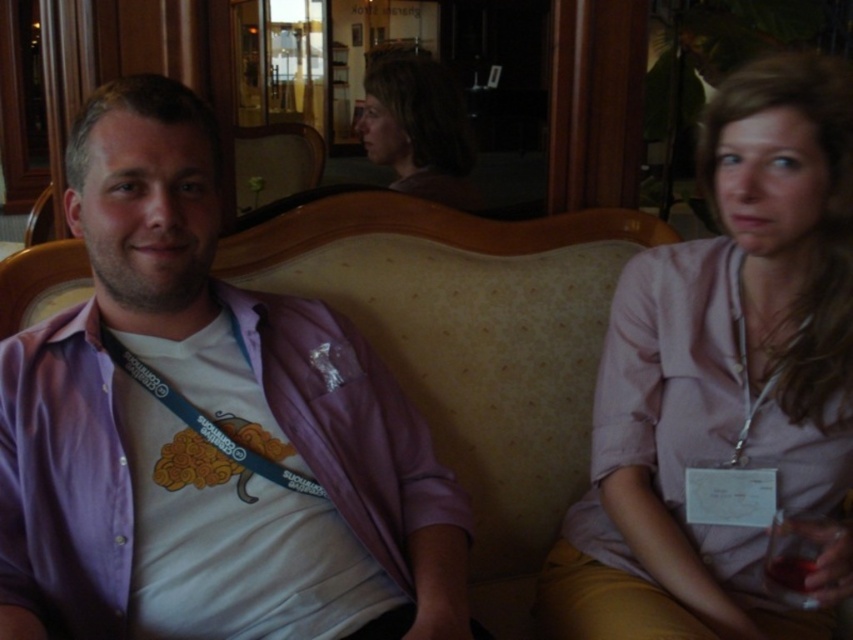
Consider the image. You are a photographer setting up a shoot in this living room. You need to place a small prop between the purple cotton shirt at left and the blue fabric lanyard at center. Where should you place it to ensure it is between them?

The purple cotton shirt at left is positioned on the left side of blue fabric lanyard at center, so placing the prop between them would require placing it to the right of the purple cotton shirt at left and to the left of the blue fabric lanyard at center.

Based on the scene description, where is the matte brown hair at center located in terms of coordinates? Please provide the coordinates as a point in the format of point followed by two numbers between 0 and 1 separated by commas, like point 0.5,0.5.

The matte brown hair at center is located at point (418, 129).